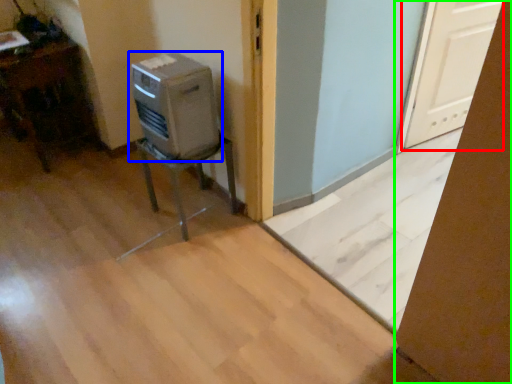
Question: Which object is positioned farthest from screen door (highlighted by a red box)? Select from home appliance (highlighted by a blue box) and cardboard box (highlighted by a green box).

Choices:
 (A) home appliance
 (B) cardboard box

Answer: (B)